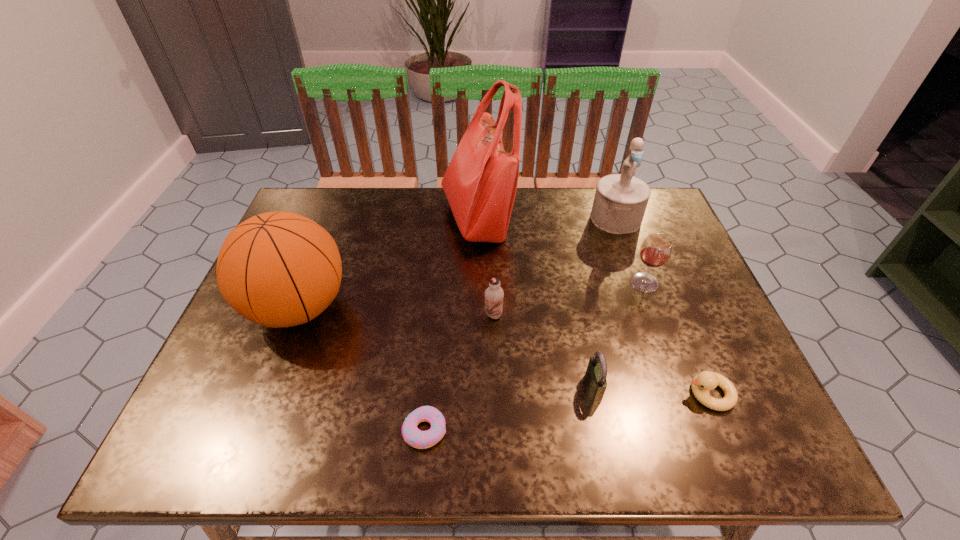
This screenshot has width=960, height=540. I want to click on object that is the fifth nearest to the chocolate milk, so click(656, 249).

Identify which object is the second closest to the figurine. Please provide its 2D coordinates. Your answer should be formatted as a tuple, i.e. [(x, y)], where the tuple contains the x and y coordinates of a point satisfying the conditions above.

[(480, 183)]

In order to click on free region that satisfies the following two spatial constraints: 1. on the front-facing side of the chocolate milk; 2. on the left side of the handbag in this screenshot , I will do `click(476, 315)`.

Locate an element on the screen. Image resolution: width=960 pixels, height=540 pixels. free space that satisfies the following two spatial constraints: 1. on the back side of the wineglass; 2. on the front-facing side of the handbag is located at coordinates (621, 218).

Locate an element on the screen. The width and height of the screenshot is (960, 540). vacant space that satisfies the following two spatial constraints: 1. on the front side of the padlock; 2. on the left side of the chocolate milk is located at coordinates (495, 388).

Where is `vacant point that satisfies the following two spatial constraints: 1. on the front-facing side of the handbag; 2. on the back side of the wineglass`? The width and height of the screenshot is (960, 540). vacant point that satisfies the following two spatial constraints: 1. on the front-facing side of the handbag; 2. on the back side of the wineglass is located at coordinates (477, 282).

What are the coordinates of `free space that satisfies the following two spatial constraints: 1. on the back side of the doughnut; 2. on the left side of the wineglass` in the screenshot? It's located at (439, 282).

Image resolution: width=960 pixels, height=540 pixels. What are the coordinates of `free space that satisfies the following two spatial constraints: 1. at the beak of the wineglass; 2. on the left side of the figurine` in the screenshot? It's located at (638, 282).